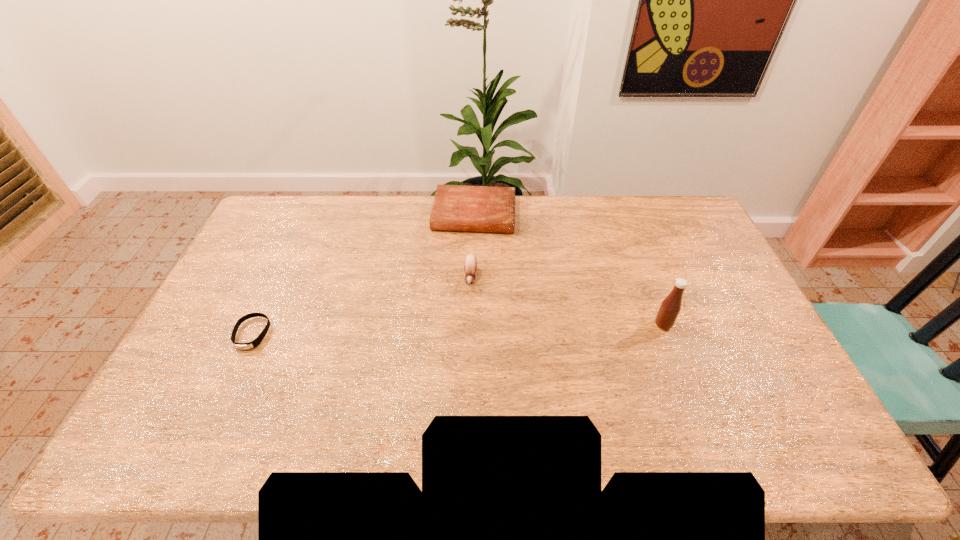
Locate an element on the screen. The width and height of the screenshot is (960, 540). vacant space on the desktop that is between the shortest object and the tallest object and is positioned on the spine side of the second shortest object is located at coordinates (460, 329).

Locate an element on the screen. Image resolution: width=960 pixels, height=540 pixels. vacant space on the desktop that is between the shortest object and the tallest object and is positioned on the front-facing side of the second tallest object is located at coordinates (466, 329).